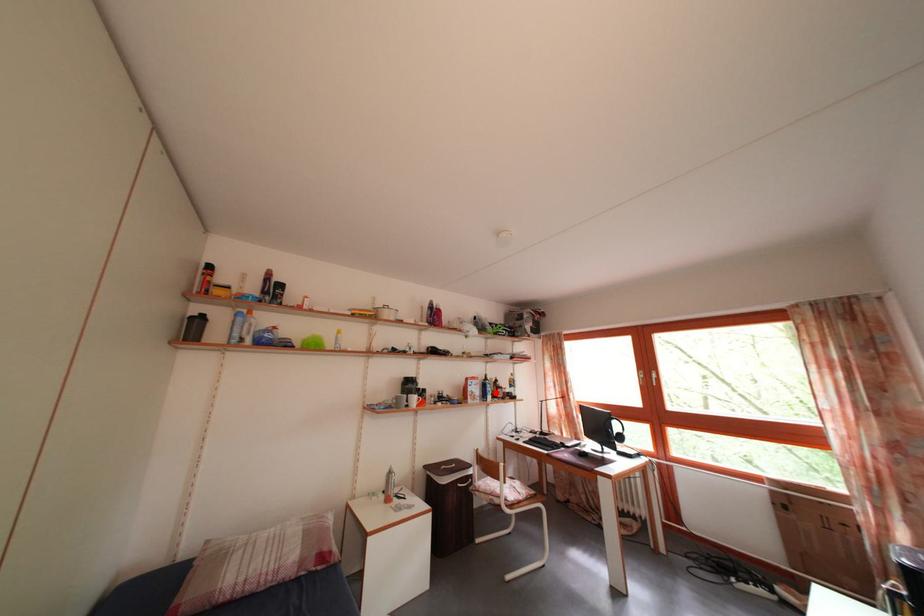
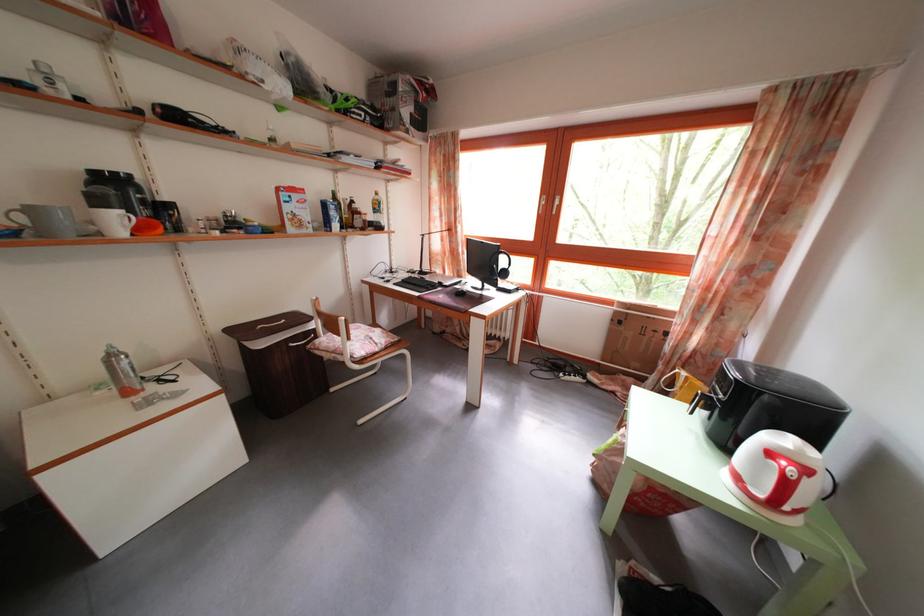
Find the pixel in the second image that matches the highlighted location in the first image.

(338, 214)